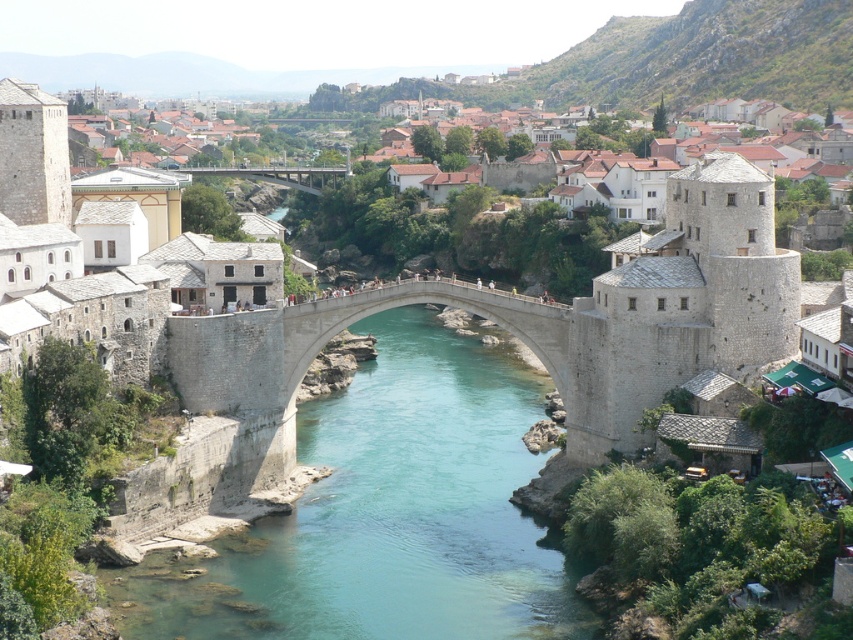
You are a tourist visiting Mostar and want to take a photo of both the white stone tower at center and the concrete bridge at center. Which object will appear larger in your photo?

The white stone tower at center will appear larger in the photo because it is bigger than the concrete bridge at center.